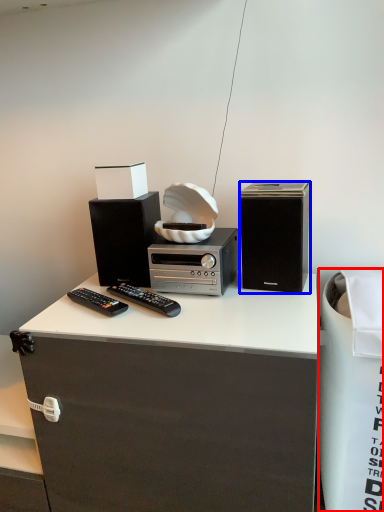
Question: Which of the following is the farthest to the observer, trash bin/can (highlighted by a red box) or loudspeaker (highlighted by a blue box)?

Choices:
 (A) trash bin/can
 (B) loudspeaker

Answer: (B)